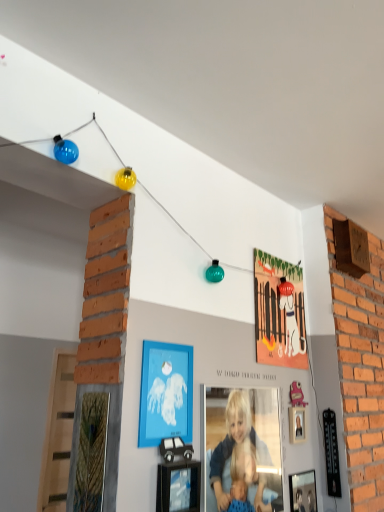
This screenshot has height=512, width=384. Identify the location of black cardboard car at lower center, the fourth picture frame when ordered from back to front. (178, 487).

What is the approximate width of matte orange picture frame at upper center, which appears as the fourth picture frame when ordered from the bottom?

matte orange picture frame at upper center, which appears as the fourth picture frame when ordered from the bottom, is 0.92 inches in width.

What is the approximate height of matte orange picture frame at upper center, arranged as the 2th picture frame when viewed from the right?

The height of matte orange picture frame at upper center, arranged as the 2th picture frame when viewed from the right, is 21.99 inches.

Locate an element on the screen. The width and height of the screenshot is (384, 512). black cardboard car at lower center, arranged as the 3th picture frame when viewed from the top is located at coordinates (178, 487).

From a real-world perspective, is black cardboard car at lower center, the second picture frame positioned from the bottom, on top of metallic silver picture frame at lower right, which is the 4th picture frame in top-to-bottom order?

Indeed, from a real-world perspective, black cardboard car at lower center, the second picture frame positioned from the bottom, stands above metallic silver picture frame at lower right, which is the 4th picture frame in top-to-bottom order.

Is metallic silver picture frame at lower right, acting as the 3th picture frame starting from the front, at the back of black cardboard car at lower center, the second picture frame positioned from the bottom?

black cardboard car at lower center, the second picture frame positioned from the bottom, is not turned away from metallic silver picture frame at lower right, acting as the 3th picture frame starting from the front.

The image size is (384, 512). Identify the location of the 2nd picture frame to the left of the metallic silver picture frame at lower right, acting as the 4th picture frame starting from the left, counting from the anchor's position. (178, 487).

Does black cardboard car at lower center, arranged as the 3th picture frame when viewed from the top, appear on the right side of metallic silver picture frame at lower right, which appears as the 1th picture frame when ordered from the bottom?

Incorrect, black cardboard car at lower center, arranged as the 3th picture frame when viewed from the top, is not on the right side of metallic silver picture frame at lower right, which appears as the 1th picture frame when ordered from the bottom.

Is smooth blonde hair at center to the left or to the right of matte orange picture frame at upper center, which is counted as the first picture frame, starting from the top, in the image?

Clearly, smooth blonde hair at center is on the left of matte orange picture frame at upper center, which is counted as the first picture frame, starting from the top, in the image.

Can you confirm if smooth blonde hair at center is thinner than matte orange picture frame at upper center, the first picture frame positioned from the back?

In fact, smooth blonde hair at center might be wider than matte orange picture frame at upper center, the first picture frame positioned from the back.

Is smooth blonde hair at center inside the boundaries of matte orange picture frame at upper center, arranged as the 2th picture frame when viewed from the right, or outside?

smooth blonde hair at center is spatially situated outside matte orange picture frame at upper center, arranged as the 2th picture frame when viewed from the right.

The height and width of the screenshot is (512, 384). What are the coordinates of `the 2nd picture frame behind the smooth blonde hair at center` in the screenshot? It's located at (279, 312).

Based on their sizes in the image, would you say matte orange picture frame at upper center, the third picture frame from the left, is bigger or smaller than smooth blonde hair at center?

Clearly, matte orange picture frame at upper center, the third picture frame from the left, is smaller in size than smooth blonde hair at center.

Considering the relative sizes of matte orange picture frame at upper center, the third picture frame from the left, and smooth blonde hair at center in the image provided, is matte orange picture frame at upper center, the third picture frame from the left, thinner than smooth blonde hair at center?

Yes.

From a real-world perspective, is matte orange picture frame at upper center, arranged as the 2th picture frame when viewed from the right, located higher than smooth blonde hair at center?

Yes.

Who is taller, black cardboard car at lower center, which is the second picture frame from left to right, or matte orange picture frame at upper center, which is counted as the first picture frame, starting from the top?

matte orange picture frame at upper center, which is counted as the first picture frame, starting from the top, is taller.

Find the location of a particular element. The image size is (384, 512). the 2nd picture frame below the matte orange picture frame at upper center, marked as the fourth picture frame in a front-to-back arrangement (from the image's perspective) is located at coordinates (178, 487).

Looking at their sizes, would you say black cardboard car at lower center, the fourth picture frame when ordered from back to front, is wider or thinner than matte orange picture frame at upper center, arranged as the 2th picture frame when viewed from the right?

Clearly, black cardboard car at lower center, the fourth picture frame when ordered from back to front, has more width compared to matte orange picture frame at upper center, arranged as the 2th picture frame when viewed from the right.

Is blue matte picture frame at center, the 3th picture frame from the back, far away from matte orange picture frame at upper center, which appears as the fourth picture frame when ordered from the bottom?

blue matte picture frame at center, the 3th picture frame from the back, is near matte orange picture frame at upper center, which appears as the fourth picture frame when ordered from the bottom, not far away.

You are a GUI agent. You are given a task and a screenshot of the screen. Output one action in this format:
    pyautogui.click(x=<x>, y=<y>)
    Task: Click on the picture frame that is the 2nd one when counting rightward from the blue matte picture frame at center, which appears as the third picture frame when ordered from the bottom
    This screenshot has height=512, width=384.
    Given the screenshot: What is the action you would take?
    pyautogui.click(x=279, y=312)

From a real-world perspective, between blue matte picture frame at center, which is the 2th picture frame from front to back, and matte orange picture frame at upper center, the third picture frame from the left, who is vertically higher?

matte orange picture frame at upper center, the third picture frame from the left, is physically above.

Between point (178, 345) and point (256, 285), which one is positioned behind?

The point (256, 285) is behind.

Is matte orange picture frame at upper center, the third picture frame from the left, not near blue matte picture frame at center, which is the 2th picture frame from front to back?

No, matte orange picture frame at upper center, the third picture frame from the left, is not far away from blue matte picture frame at center, which is the 2th picture frame from front to back.

Can you confirm if matte orange picture frame at upper center, the third picture frame from the left, is taller than blue matte picture frame at center, the 2th picture frame viewed from the top?

Indeed, matte orange picture frame at upper center, the third picture frame from the left, has a greater height compared to blue matte picture frame at center, the 2th picture frame viewed from the top.

Does matte orange picture frame at upper center, marked as the fourth picture frame in a front-to-back arrangement, have a lesser width compared to blue matte picture frame at center, the 2th picture frame viewed from the top?

No, matte orange picture frame at upper center, marked as the fourth picture frame in a front-to-back arrangement, is not thinner than blue matte picture frame at center, the 2th picture frame viewed from the top.

Which is less distant, (x=299, y=366) or (x=165, y=345)?

The point (x=165, y=345) is closer to the camera.

Is smooth blonde hair at center at the left side of black cardboard car at lower center, positioned as the 1th picture frame in front-to-back order?

No, smooth blonde hair at center is not to the left of black cardboard car at lower center, positioned as the 1th picture frame in front-to-back order.

Based on the photo, is there a large distance between smooth blonde hair at center and black cardboard car at lower center, positioned as the 1th picture frame in front-to-back order?

No, smooth blonde hair at center is in close proximity to black cardboard car at lower center, positioned as the 1th picture frame in front-to-back order.

Could black cardboard car at lower center, the third picture frame when ordered from right to left, be considered to be inside smooth blonde hair at center?

No, smooth blonde hair at center does not contain black cardboard car at lower center, the third picture frame when ordered from right to left.

Starting from the black cardboard car at lower center, which is the second picture frame from left to right, which picture frame is the 2nd one behind? Please provide its 2D coordinates.

[(303, 492)]

There is a smooth blonde hair at center. Find the location of `the 2nd picture frame above it (from a real-world perspective)`. the 2nd picture frame above it (from a real-world perspective) is located at coordinates (279, 312).

When comparing their distances from black cardboard car at lower center, which is the second picture frame from left to right, does metallic silver picture frame at lower right, marked as the second picture frame in a back-to-front arrangement, or blue matte picture frame at center, which ranks as the 1th picture frame in left-to-right order, seem closer?

blue matte picture frame at center, which ranks as the 1th picture frame in left-to-right order, lies closer to black cardboard car at lower center, which is the second picture frame from left to right, than the other object.

Estimate the real-world distances between objects in this image. Which object is further from metallic silver picture frame at lower right, which appears as the 1th picture frame when ordered from the bottom, black cardboard car at lower center, the second picture frame positioned from the bottom, or smooth blonde hair at center?

The object further to metallic silver picture frame at lower right, which appears as the 1th picture frame when ordered from the bottom, is black cardboard car at lower center, the second picture frame positioned from the bottom.

Based on their spatial positions, is blue matte picture frame at center, which ranks as the 1th picture frame in left-to-right order, or matte orange picture frame at upper center, which is counted as the first picture frame, starting from the top, further from black cardboard car at lower center, the third picture frame when ordered from right to left?

Among the two, matte orange picture frame at upper center, which is counted as the first picture frame, starting from the top, is located further to black cardboard car at lower center, the third picture frame when ordered from right to left.

Based on their spatial positions, is smooth blonde hair at center or black cardboard car at lower center, arranged as the 3th picture frame when viewed from the top, further from blue matte picture frame at center, the 2th picture frame viewed from the top?

smooth blonde hair at center is positioned further to the anchor blue matte picture frame at center, the 2th picture frame viewed from the top.

From the image, which object appears to be farther from matte orange picture frame at upper center, the first picture frame positioned from the back, smooth blonde hair at center or blue matte picture frame at center, which is the 2th picture frame from front to back?

blue matte picture frame at center, which is the 2th picture frame from front to back, is positioned further to the anchor matte orange picture frame at upper center, the first picture frame positioned from the back.

When comparing their distances from smooth blonde hair at center, does blue matte picture frame at center, the 3th picture frame from the back, or black cardboard car at lower center, the third picture frame when ordered from right to left, seem further?

Based on the image, blue matte picture frame at center, the 3th picture frame from the back, appears to be further to smooth blonde hair at center.

When comparing their distances from smooth blonde hair at center, does metallic silver picture frame at lower right, acting as the 4th picture frame starting from the left, or blue matte picture frame at center, the 3th picture frame from the back, seem further?

metallic silver picture frame at lower right, acting as the 4th picture frame starting from the left, is further to smooth blonde hair at center.

Based on their spatial positions, is black cardboard car at lower center, the third picture frame when ordered from right to left, or blue matte picture frame at center, the 2th picture frame viewed from the top, further from metallic silver picture frame at lower right, which is the 4th picture frame in top-to-bottom order?

blue matte picture frame at center, the 2th picture frame viewed from the top, is positioned further to the anchor metallic silver picture frame at lower right, which is the 4th picture frame in top-to-bottom order.

Locate an element on the screen. The height and width of the screenshot is (512, 384). picture frame between blue matte picture frame at center, the 3th picture frame from the back, and metallic silver picture frame at lower right, marked as the second picture frame in a back-to-front arrangement, in the vertical direction is located at coordinates (178, 487).

Identify the location of picture frame between blue matte picture frame at center, which is the 2th picture frame from front to back, and smooth blonde hair at center vertically. (178, 487).

Identify the location of person between black cardboard car at lower center, which is the second picture frame from left to right, and matte orange picture frame at upper center, the third picture frame from the left, from front to back. (239, 457).

The height and width of the screenshot is (512, 384). What are the coordinates of `person between black cardboard car at lower center, the third picture frame when ordered from right to left, and metallic silver picture frame at lower right, acting as the 4th picture frame starting from the left, in the horizontal direction` in the screenshot? It's located at (239, 457).